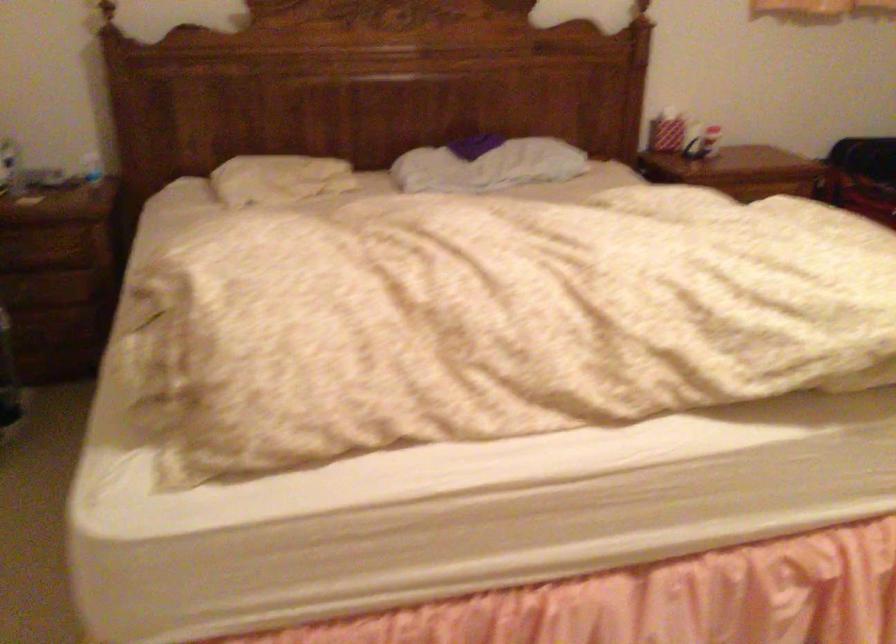
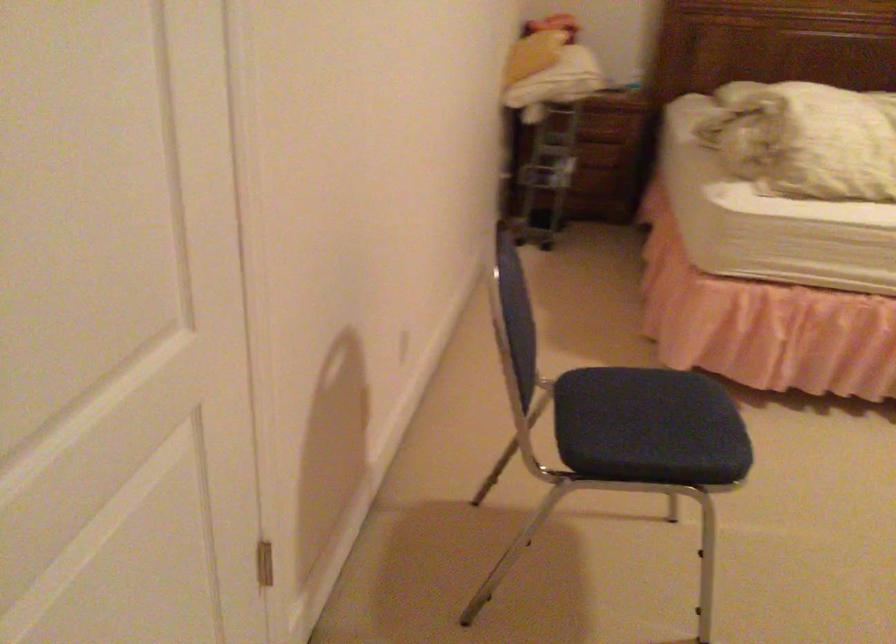
Question: What movement of the cameraman would produce the second image?

Choices:
 (A) Left
 (B) Right
 (C) Forward
 (D) Backward

Answer: (D)